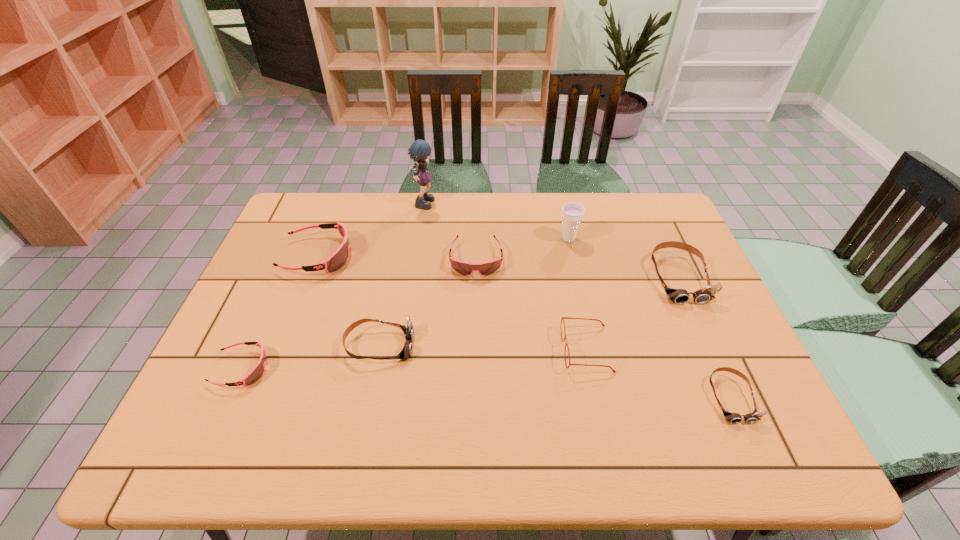
Find the location of a particular element. This screenshot has width=960, height=540. vacant region located on the face of the spectacles is located at coordinates (499, 349).

Locate an element on the screen. The height and width of the screenshot is (540, 960). vacant space situated on the face of the spectacles is located at coordinates (446, 349).

You are a GUI agent. You are given a task and a screenshot of the screen. Output one action in this format:
    pyautogui.click(x=<x>, y=<y>)
    Task: Click on the free space located 0.250m on the front-facing side of the nearest pink goggles
    
    Given the screenshot: What is the action you would take?
    pyautogui.click(x=372, y=369)

Find the location of a particular element. The width and height of the screenshot is (960, 540). vacant point located on the front-facing side of the smallest brown goggles is located at coordinates (756, 456).

Where is `rag doll positioned at the far edge`? The image size is (960, 540). rag doll positioned at the far edge is located at coordinates (419, 151).

The image size is (960, 540). Identify the location of cup located in the far edge section of the desktop. (572, 213).

Where is `goggles present at the far edge`? Image resolution: width=960 pixels, height=540 pixels. goggles present at the far edge is located at coordinates (335, 261).

At what (x,y) coordinates should I click in order to perform the action: click on object located at the near edge. Please return your answer as a coordinate pair (x, y). This screenshot has width=960, height=540. Looking at the image, I should click on (734, 418).

In order to click on object that is positioned at the far left corner in this screenshot , I will do `click(335, 261)`.

Where is `object at the near right corner`? This screenshot has width=960, height=540. object at the near right corner is located at coordinates (734, 418).